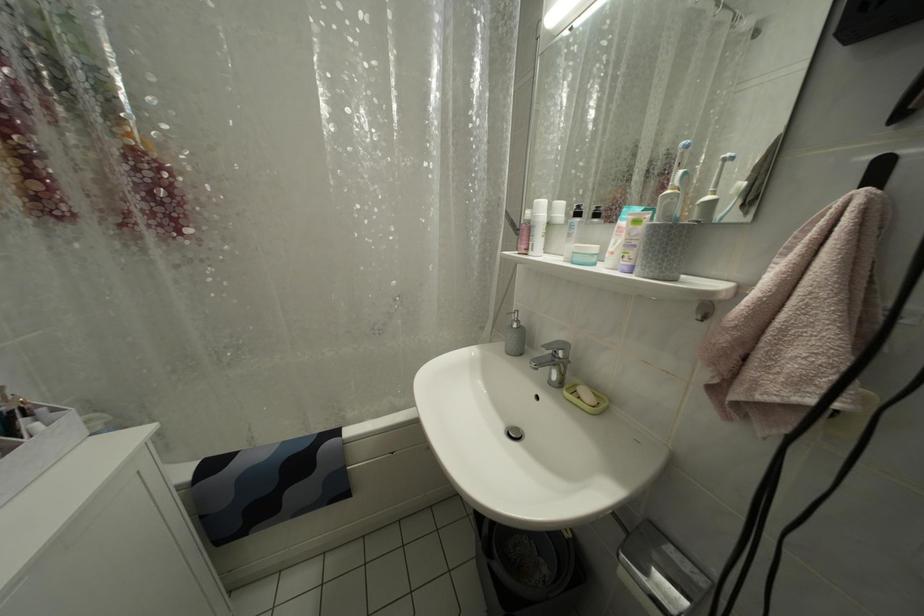
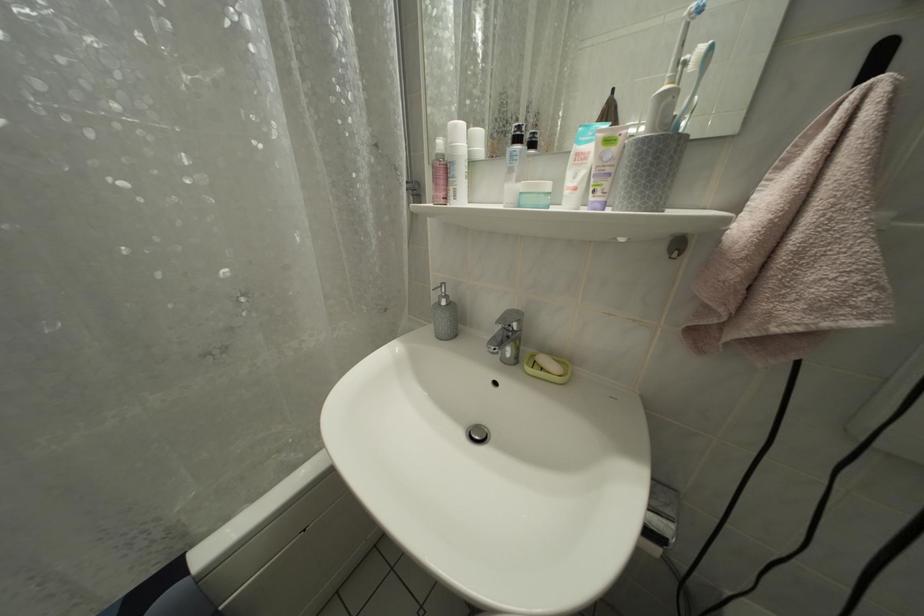
Question: The camera is either moving clockwise (left) or counter-clockwise (right) around the object. The first image is from the beginning of the video and the second image is from the end. Is the camera moving left or right when shooting the video?

Choices:
 (A) Left
 (B) Right

Answer: (A)